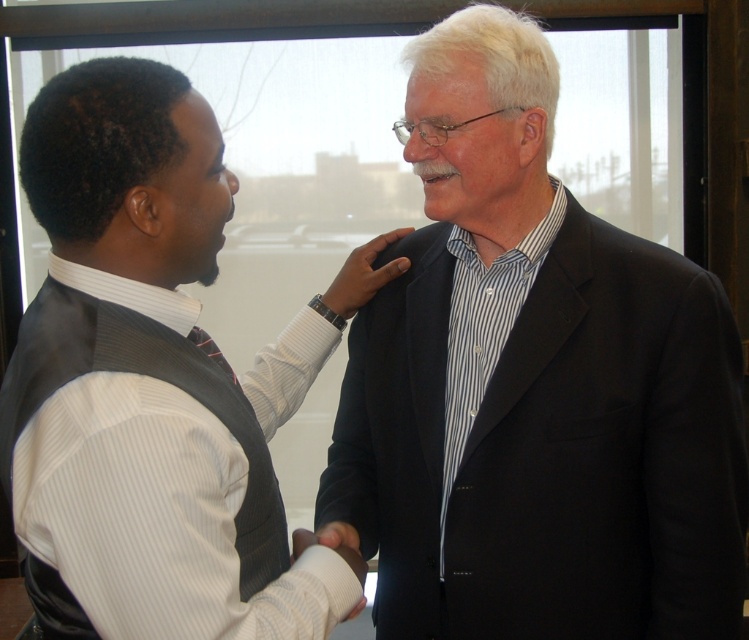
Question: Can you confirm if black matte suit at center is smaller than white striped shirt at upper left?

Choices:
 (A) yes
 (B) no

Answer: (B)

Question: Is black matte suit at center to the right of black silk tie at center from the viewer's perspective?

Choices:
 (A) yes
 (B) no

Answer: (A)

Question: Among these points, which one is farthest from the camera?

Choices:
 (A) (294, 544)
 (B) (380, 278)
 (C) (261, 506)
 (D) (594, 259)

Answer: (B)

Question: Is the position of white fabric hand at center more distant than that of black silk tie at center?

Choices:
 (A) yes
 (B) no

Answer: (A)

Question: Which is farther from the black leather hand at center?

Choices:
 (A) white striped shirt at upper left
 (B) white fabric hand at center
 (C) black silk tie at center
 (D) black matte suit at center

Answer: (A)

Question: Which of these objects is positioned closest to the black leather hand at center?

Choices:
 (A) black matte suit at center
 (B) white striped shirt at upper left
 (C) black silk tie at center
 (D) white fabric hand at center

Answer: (A)